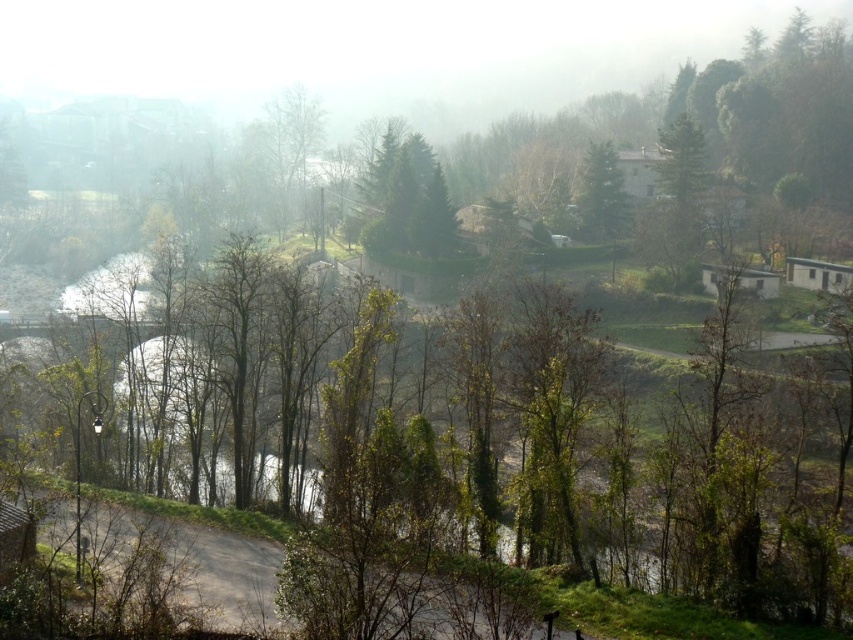
Is green textured tree at center shorter than green matte tree at upper center?

No.

Describe the element at coordinates (408, 198) in the screenshot. I see `green textured tree at center` at that location.

Describe the element at coordinates (408, 198) in the screenshot. I see `green textured tree at center` at that location.

The image size is (853, 640). Find the location of `green textured tree at center`. green textured tree at center is located at coordinates (408, 198).